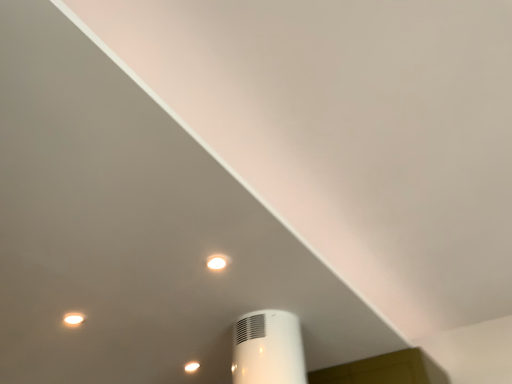
You are a GUI agent. You are given a task and a screenshot of the screen. Output one action in this format:
    pyautogui.click(x=<x>, y=<y>)
    Task: Click on the white matte air conditioner at upper center
    The width and height of the screenshot is (512, 384).
    Given the screenshot: What is the action you would take?
    pyautogui.click(x=268, y=349)

Describe the element at coordinates (268, 349) in the screenshot. The image size is (512, 384). I see `white matte air conditioner at upper center` at that location.

What is the approximate height of white matte air conditioner at upper center?

It is 12.54 inches.

Find the location of a particular element. The height and width of the screenshot is (384, 512). white matte air conditioner at upper center is located at coordinates (268, 349).